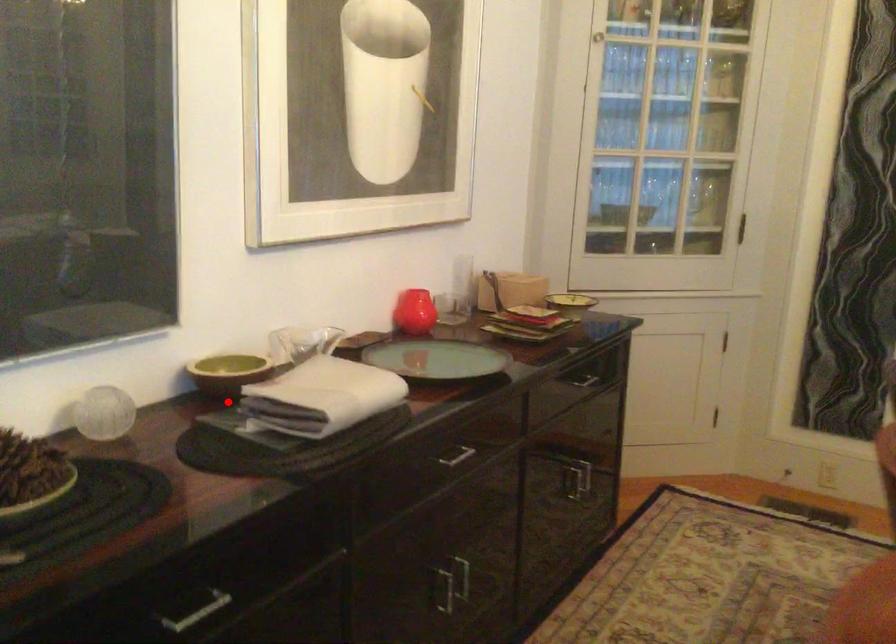
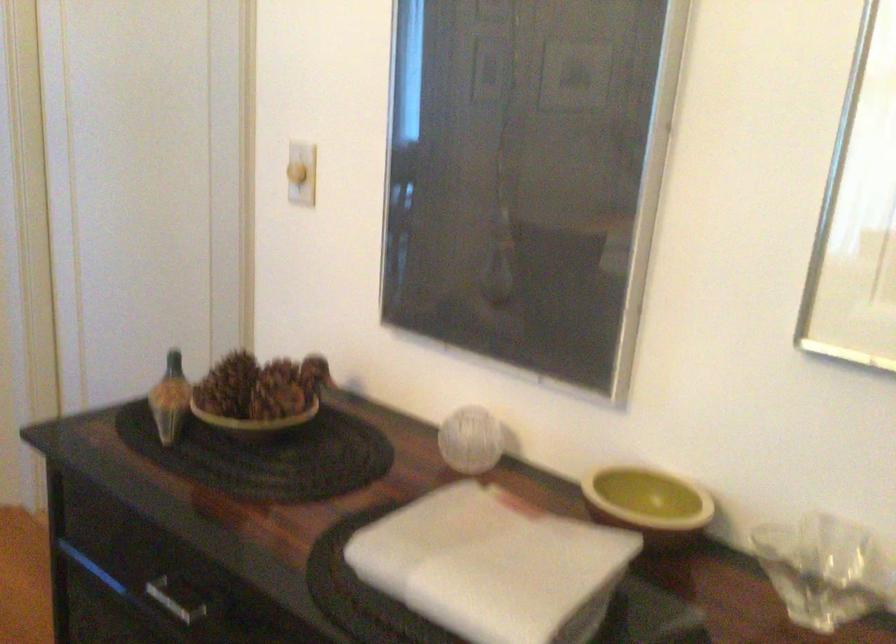
Question: I am providing you with two images of the same scene from different viewpoints. In image1, a red point is highlighted. Considering the same 3D point in image2, which of the following is correct?

Choices:
 (A) It is closer
 (B) It is farther

Answer: (A)